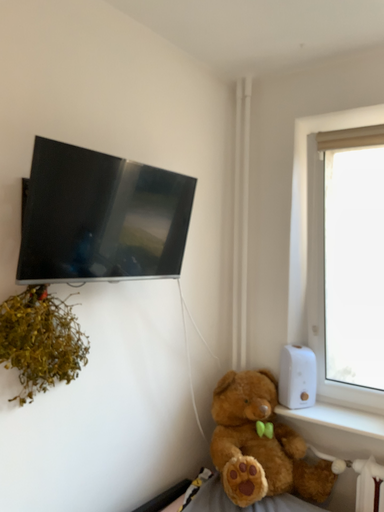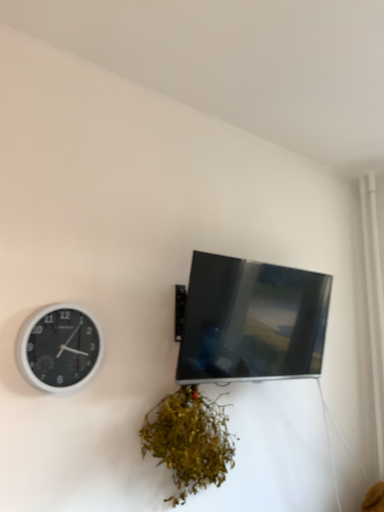
Question: Which way did the camera rotate in the video?

Choices:
 (A) rotated left
 (B) rotated right

Answer: (A)